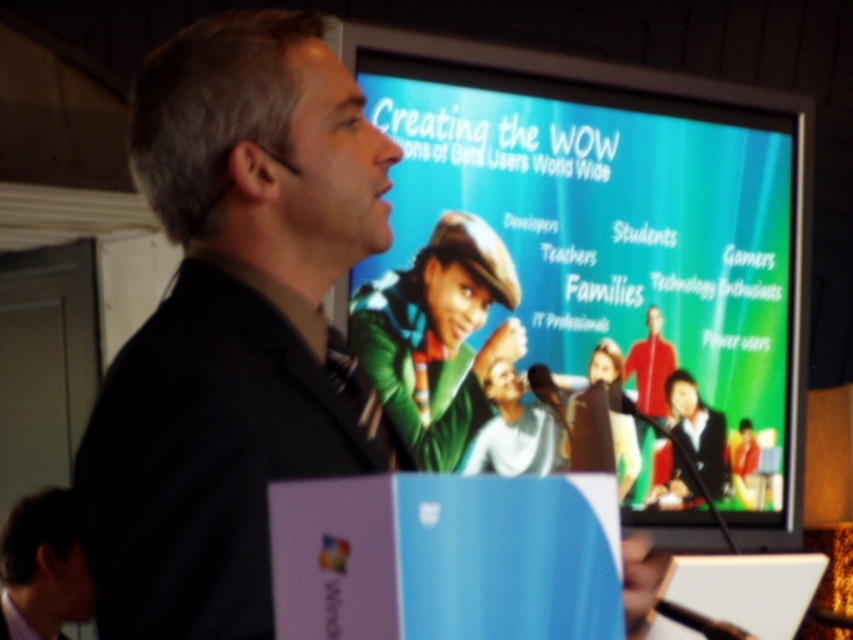
Question: From the image, what is the correct spatial relationship of matte plastic screen at upper center in relation to white matte shirt at center?

Choices:
 (A) above
 (B) below

Answer: (A)

Question: Which object appears farthest from the camera in this image?

Choices:
 (A) white matte shirt at center
 (B) matte plastic screen at upper center
 (C) black matte suit at center
 (D) white plastic laptop at center

Answer: (A)

Question: Among these points, which one is nearest to the camera?

Choices:
 (A) (520, 440)
 (B) (732, 618)
 (C) (764, 304)

Answer: (B)

Question: In this image, where is matte plastic screen at upper center located relative to black matte suit at center?

Choices:
 (A) right
 (B) left

Answer: (A)

Question: In this image, where is matte plastic screen at upper center located relative to white matte shirt at center?

Choices:
 (A) below
 (B) above

Answer: (B)

Question: Which point is farther from the camera taking this photo?

Choices:
 (A) (587, 292)
 (B) (277, 221)

Answer: (A)